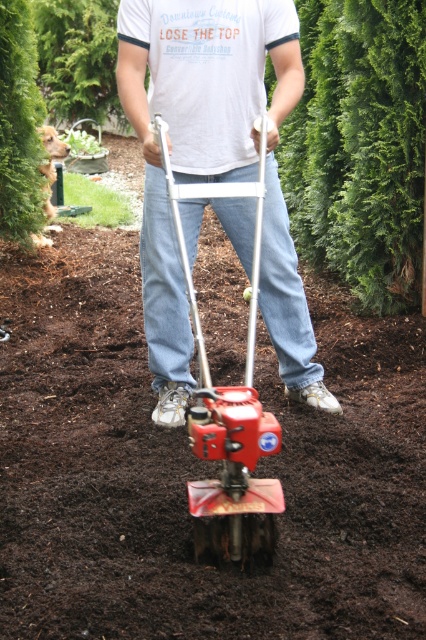
Is metallic red tiller at center to the right of red metallic lawn mower at center from the viewer's perspective?

Indeed, metallic red tiller at center is positioned on the right side of red metallic lawn mower at center.

Is metallic red tiller at center thinner than red metallic lawn mower at center?

No.

Is point (229, 70) behind point (161, 140)?

Yes, point (229, 70) is farther from viewer.

Find the location of a particular element. The width and height of the screenshot is (426, 640). metallic red tiller at center is located at coordinates (213, 168).

Looking at this image, between red metallic lawn mower at center and green leafy hedge at upper left, which one is positioned higher?

Positioned higher is green leafy hedge at upper left.

Does red metallic lawn mower at center appear on the left side of green leafy hedge at upper left?

No, red metallic lawn mower at center is not to the left of green leafy hedge at upper left.

Who is more forward, (213, 548) or (14, 88)?

Point (213, 548) is in front.

I want to click on red metallic lawn mower at center, so click(227, 406).

Between metallic red tiller at center and green leafy hedge at upper left, which one appears on the left side from the viewer's perspective?

Positioned to the left is green leafy hedge at upper left.

In the scene shown: Who is taller, metallic red tiller at center or green leafy hedge at upper left?

green leafy hedge at upper left is taller.

Find the location of a particular element. Image resolution: width=426 pixels, height=640 pixels. metallic red tiller at center is located at coordinates pyautogui.click(x=213, y=168).